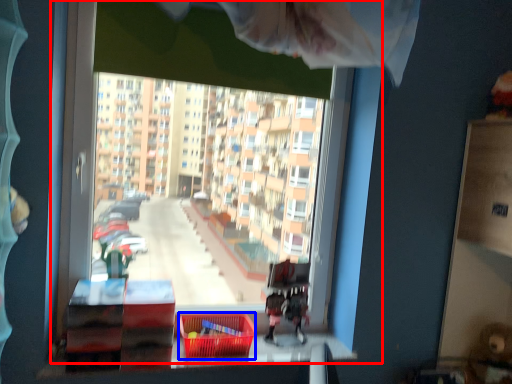
Question: Among these objects, which one is nearest to the camera, window (highlighted by a red box) or basket (highlighted by a blue box)?

Choices:
 (A) window
 (B) basket

Answer: (A)